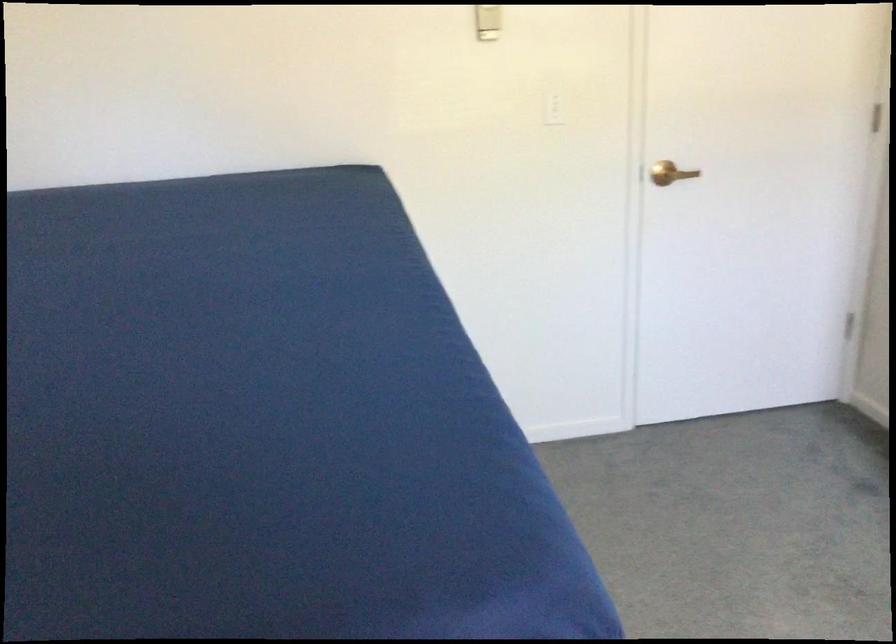
Describe the element at coordinates (670, 172) in the screenshot. I see `a brass door handle` at that location.